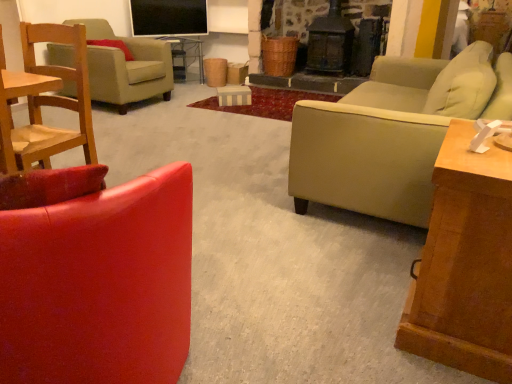
This screenshot has height=384, width=512. Identify the location of free space behind wooden side table at right. (379, 241).